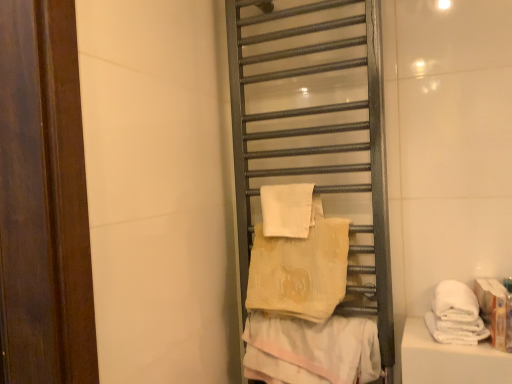
Question: Is beige textured towel at center, arranged as the 1th towel when ordered from the bottom, smaller than beige soft towel at center, acting as the second towel starting from the top?

Choices:
 (A) no
 (B) yes

Answer: (B)

Question: Can you confirm if beige textured towel at center, arranged as the 1th towel when ordered from the bottom, is thinner than beige soft towel at center, positioned as the third towel in bottom-to-top order?

Choices:
 (A) no
 (B) yes

Answer: (B)

Question: Could you tell me if beige textured towel at center, arranged as the 1th towel when ordered from the bottom, is facing beige soft towel at center, positioned as the third towel in bottom-to-top order?

Choices:
 (A) yes
 (B) no

Answer: (B)

Question: From the image's perspective, does beige textured towel at center, the 4th towel viewed from the top, appear higher than beige soft towel at center, acting as the second towel starting from the top?

Choices:
 (A) yes
 (B) no

Answer: (B)

Question: Can you confirm if beige textured towel at center, arranged as the 1th towel when ordered from the bottom, is positioned to the right of beige soft towel at center, positioned as the third towel in bottom-to-top order?

Choices:
 (A) no
 (B) yes

Answer: (B)

Question: In the image, is beige soft towel at center, positioned as the third towel in bottom-to-top order, on the left side or the right side of metallic towel rack at center?

Choices:
 (A) right
 (B) left

Answer: (B)

Question: From the image's perspective, is beige soft towel at center, positioned as the third towel in bottom-to-top order, positioned above or below metallic towel rack at center?

Choices:
 (A) below
 (B) above

Answer: (A)

Question: Is beige soft towel at center, positioned as the third towel in bottom-to-top order, spatially inside metallic towel rack at center, or outside of it?

Choices:
 (A) outside
 (B) inside

Answer: (B)

Question: Considering the positions of beige soft towel at center, acting as the second towel starting from the top, and metallic towel rack at center in the image, is beige soft towel at center, acting as the second towel starting from the top, taller or shorter than metallic towel rack at center?

Choices:
 (A) short
 (B) tall

Answer: (A)

Question: Is white soft towel at right, arranged as the second towel when ordered from the bottom, situated inside beige textured towel at center, the 4th towel viewed from the top, or outside?

Choices:
 (A) outside
 (B) inside

Answer: (A)

Question: Does point (445, 304) appear closer or farther from the camera than point (329, 377)?

Choices:
 (A) farther
 (B) closer

Answer: (B)

Question: From the image's perspective, is white soft towel at right, arranged as the second towel when ordered from the bottom, positioned above or below beige textured towel at center, the 4th towel viewed from the top?

Choices:
 (A) above
 (B) below

Answer: (A)

Question: Looking at the image, does white soft towel at right, arranged as the second towel when ordered from the bottom, seem bigger or smaller compared to beige textured towel at center, the 4th towel viewed from the top?

Choices:
 (A) big
 (B) small

Answer: (B)

Question: Considering the positions of point (268, 208) and point (328, 354), is point (268, 208) closer or farther from the camera than point (328, 354)?

Choices:
 (A) farther
 (B) closer

Answer: (A)

Question: Which is correct: white soft towel at center, acting as the fourth towel starting from the bottom, is inside beige textured towel at center, arranged as the 1th towel when ordered from the bottom, or outside of it?

Choices:
 (A) inside
 (B) outside

Answer: (B)